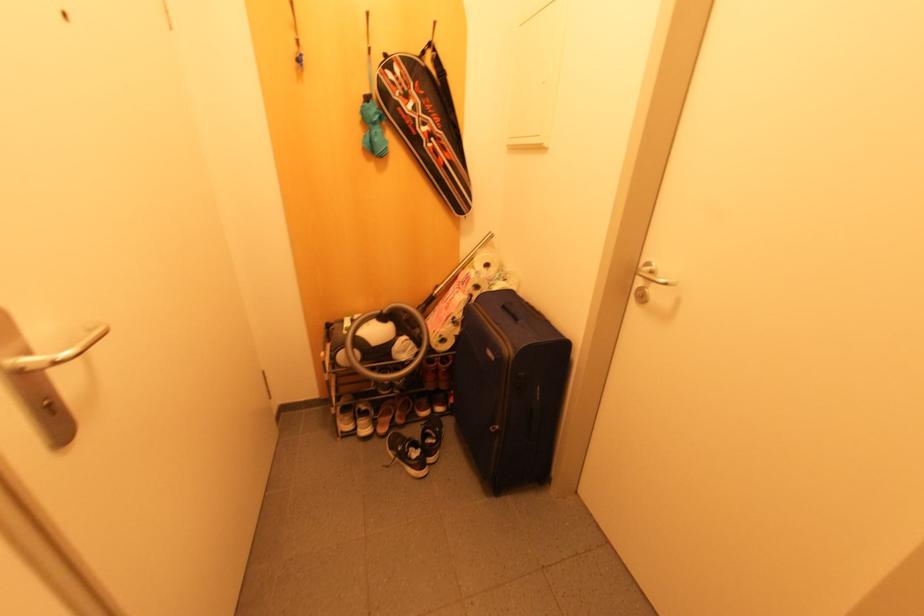
Which object does [424,124] point to?

This point indicates the pink patterned skateboard.